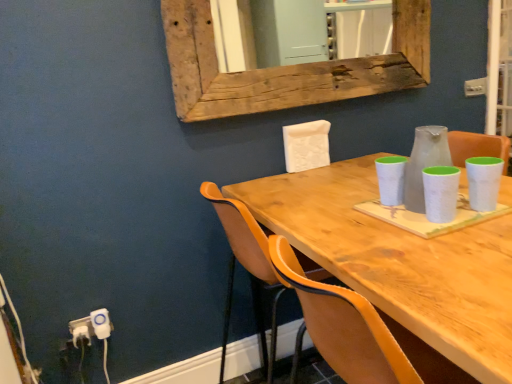
Question: Considering the relative sizes of orange leather chair at center and wooden table at center in the image provided, is orange leather chair at center taller than wooden table at center?

Choices:
 (A) yes
 (B) no

Answer: (A)

Question: Is orange leather chair at center smaller than wooden table at center?

Choices:
 (A) yes
 (B) no

Answer: (A)

Question: Does orange leather chair at center come in front of wooden table at center?

Choices:
 (A) yes
 (B) no

Answer: (B)

Question: From a real-world perspective, is orange leather chair at center positioned over wooden table at center based on gravity?

Choices:
 (A) no
 (B) yes

Answer: (B)

Question: Considering the relative sizes of orange leather chair at center and wooden table at center in the image provided, is orange leather chair at center wider than wooden table at center?

Choices:
 (A) no
 (B) yes

Answer: (A)

Question: Does orange leather chair at center have a lesser width compared to wooden table at center?

Choices:
 (A) no
 (B) yes

Answer: (B)

Question: Is weathered wood mirror at upper center positioned behind wooden table at center?

Choices:
 (A) no
 (B) yes

Answer: (B)

Question: Is weathered wood mirror at upper center aimed at wooden table at center?

Choices:
 (A) yes
 (B) no

Answer: (B)

Question: Is weathered wood mirror at upper center surrounding wooden table at center?

Choices:
 (A) no
 (B) yes

Answer: (A)

Question: Considering the relative positions of weathered wood mirror at upper center and wooden table at center in the image provided, is weathered wood mirror at upper center in front of wooden table at center?

Choices:
 (A) yes
 (B) no

Answer: (B)

Question: Can you confirm if weathered wood mirror at upper center is taller than wooden table at center?

Choices:
 (A) yes
 (B) no

Answer: (B)

Question: From the image's perspective, would you say weathered wood mirror at upper center is positioned over wooden table at center?

Choices:
 (A) yes
 (B) no

Answer: (A)

Question: Is white plastic electric outlet at lower left, the 1th electric outlet viewed from the right, next to weathered wood mirror at upper center?

Choices:
 (A) no
 (B) yes

Answer: (A)